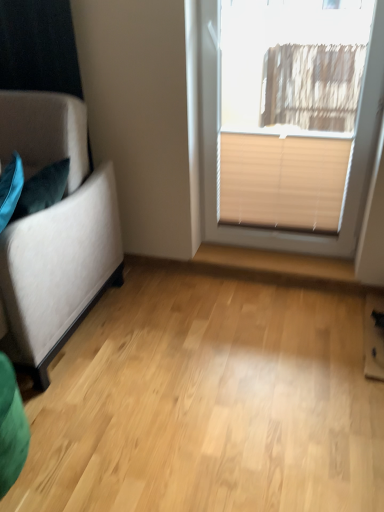
In order to click on beige fabric blind at upper right in this screenshot , I will do `click(283, 181)`.

The width and height of the screenshot is (384, 512). Describe the element at coordinates (216, 147) in the screenshot. I see `beige blind at upper right` at that location.

You are a GUI agent. You are given a task and a screenshot of the screen. Output one action in this format:
    pyautogui.click(x=<x>, y=<y>)
    Task: Click on the beige fabric blind at upper right
    Image resolution: width=384 pixels, height=512 pixels.
    Given the screenshot: What is the action you would take?
    pyautogui.click(x=283, y=181)

Between suede-like beige couch at left and beige blind at upper right, which one is positioned in front?

suede-like beige couch at left is more forward.

Is suede-like beige couch at left beside beige blind at upper right?

No, suede-like beige couch at left is not touching beige blind at upper right.

From a real-world perspective, is suede-like beige couch at left physically below beige blind at upper right?

Correct, in the physical world, suede-like beige couch at left is lower than beige blind at upper right.

Is point (308, 179) more distant than point (371, 161)?

Yes, it is behind point (371, 161).

Is beige fabric blind at upper right next to beige blind at upper right and touching it?

beige fabric blind at upper right is not next to beige blind at upper right, and they're not touching.

From a real-world perspective, between beige fabric blind at upper right and beige blind at upper right, who is vertically lower?

beige fabric blind at upper right is physically lower.

Consider the image. From the image's perspective, is beige fabric blind at upper right located above or below beige blind at upper right?

beige fabric blind at upper right is below beige blind at upper right.

Is beige blind at upper right at the right side of suede-like beige couch at left?

Indeed, beige blind at upper right is positioned on the right side of suede-like beige couch at left.

Relative to suede-like beige couch at left, is beige blind at upper right in front or behind?

Clearly, beige blind at upper right is behind suede-like beige couch at left.

Which object is thinner, beige blind at upper right or suede-like beige couch at left?

With smaller width is beige blind at upper right.

From the image's perspective, is beige blind at upper right located above suede-like beige couch at left?

Yes, from the image's perspective, beige blind at upper right is above suede-like beige couch at left.

From a real-world perspective, who is located lower, suede-like beige couch at left or beige fabric blind at upper right?

beige fabric blind at upper right is physically lower.

Who is shorter, suede-like beige couch at left or beige fabric blind at upper right?

beige fabric blind at upper right is shorter.

Is point (20, 118) positioned after point (336, 178)?

No, it is in front of (336, 178).

Where is `studio couch that is below the beige fabric blind at upper right (from the image's perspective)`? This screenshot has width=384, height=512. studio couch that is below the beige fabric blind at upper right (from the image's perspective) is located at coordinates (54, 231).

Is suede-like beige couch at left aimed at light wood floor at center?

No, suede-like beige couch at left does not turn towards light wood floor at center.

Can you confirm if suede-like beige couch at left is smaller than light wood floor at center?

No, suede-like beige couch at left is not smaller than light wood floor at center.

Does suede-like beige couch at left have a lesser height compared to light wood floor at center?

Incorrect, the height of suede-like beige couch at left does not fall short of that of light wood floor at center.

Which object is further away from the camera taking this photo, suede-like beige couch at left or light wood floor at center?

suede-like beige couch at left is more distant.

Considering the relative sizes of light wood floor at center and beige blind at upper right in the image provided, is light wood floor at center bigger than beige blind at upper right?

Yes.

Looking at this image, would you say light wood floor at center is outside beige blind at upper right?

Yes, light wood floor at center is outside of beige blind at upper right.

Which is less distant, (56, 437) or (374, 41)?

The point (56, 437) is closer.

Is light wood floor at center in contact with beige blind at upper right?

No, light wood floor at center is not in contact with beige blind at upper right.

Between light wood floor at center and suede-like beige couch at left, which one has larger size?

suede-like beige couch at left.

Which is farther, (52,364) or (4,275)?

Point (52,364)

Looking at this image, between light wood floor at center and suede-like beige couch at left, which one appears on the right side from the viewer's perspective?

light wood floor at center is more to the right.

Locate an element on the screen. The height and width of the screenshot is (512, 384). studio couch that appears below the beige blind at upper right (from a real-world perspective) is located at coordinates (x=54, y=231).

Find the location of a particular element. window in front of the beige fabric blind at upper right is located at coordinates (216, 147).

When comparing their distances from beige fabric blind at upper right, does suede-like beige couch at left or light wood floor at center seem closer?

The object closer to beige fabric blind at upper right is light wood floor at center.

From the image, which object appears to be farther from beige fabric blind at upper right, light wood floor at center or beige blind at upper right?

light wood floor at center.

From the picture: From the image, which object appears to be farther from beige fabric blind at upper right, suede-like beige couch at left or beige blind at upper right?

suede-like beige couch at left lies further to beige fabric blind at upper right than the other object.

Estimate the real-world distances between objects in this image. Which object is further from light wood floor at center, beige fabric blind at upper right or beige blind at upper right?

Among the two, beige blind at upper right is located further to light wood floor at center.

When comparing their distances from light wood floor at center, does suede-like beige couch at left or beige blind at upper right seem closer?

suede-like beige couch at left is closer to light wood floor at center.

Which object lies nearer to the anchor point suede-like beige couch at left, beige fabric blind at upper right or beige blind at upper right?

Based on the image, beige blind at upper right appears to be nearer to suede-like beige couch at left.

Looking at the image, which one is located closer to suede-like beige couch at left, light wood floor at center or beige fabric blind at upper right?

light wood floor at center.

Looking at the image, which one is located further to beige fabric blind at upper right, beige blind at upper right or suede-like beige couch at left?

suede-like beige couch at left.

Locate an element on the screen. This screenshot has height=512, width=384. plain between suede-like beige couch at left and beige blind at upper right in the horizontal direction is located at coordinates (208, 401).

Where is `plain between suede-like beige couch at left and beige fabric blind at upper right from left to right`? plain between suede-like beige couch at left and beige fabric blind at upper right from left to right is located at coordinates (208, 401).

What are the coordinates of `blind that lies between beige blind at upper right and light wood floor at center from top to bottom` in the screenshot? It's located at (283, 181).

This screenshot has width=384, height=512. In order to click on window located between suede-like beige couch at left and beige fabric blind at upper right in the left-right direction in this screenshot , I will do 216,147.